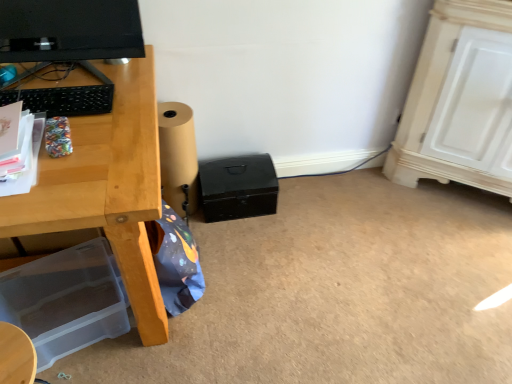
Question: Is black matte box at center, the 1th box positioned from the top, positioned before matte black monitor at upper left?

Choices:
 (A) yes
 (B) no

Answer: (B)

Question: Does black matte box at center, the first box from the right, appear on the right side of matte black monitor at upper left?

Choices:
 (A) yes
 (B) no

Answer: (A)

Question: Is matte black monitor at upper left surrounded by black matte box at center, which is counted as the second box, starting from the left?

Choices:
 (A) yes
 (B) no

Answer: (B)

Question: Considering the relative sizes of black matte box at center, the 1th box positioned from the top, and matte black monitor at upper left in the image provided, is black matte box at center, the 1th box positioned from the top, smaller than matte black monitor at upper left?

Choices:
 (A) yes
 (B) no

Answer: (B)

Question: From the image's perspective, is black matte box at center, the 1th box positioned from the top, located above matte black monitor at upper left?

Choices:
 (A) no
 (B) yes

Answer: (A)

Question: Is black matte box at center, which is counted as the second box, starting from the left, looking in the opposite direction of matte black monitor at upper left?

Choices:
 (A) no
 (B) yes

Answer: (A)

Question: Is transparent plastic storage box at lower left, the second box viewed from the top, taller than black matte box at center, the 1th box positioned from the top?

Choices:
 (A) yes
 (B) no

Answer: (B)

Question: Can you confirm if transparent plastic storage box at lower left, the second box viewed from the top, is smaller than black matte box at center, which is counted as the 2th box, starting from the bottom?

Choices:
 (A) no
 (B) yes

Answer: (A)

Question: Is transparent plastic storage box at lower left, the 2th box viewed from the right, not near black matte box at center, the first box from the right?

Choices:
 (A) no
 (B) yes

Answer: (A)

Question: Is transparent plastic storage box at lower left, which ranks as the second box in back-to-front order, in contact with black matte box at center, which is counted as the second box, starting from the left?

Choices:
 (A) yes
 (B) no

Answer: (B)

Question: Is transparent plastic storage box at lower left, acting as the first box starting from the left, to the left of black matte box at center, the first box from the right, from the viewer's perspective?

Choices:
 (A) yes
 (B) no

Answer: (A)

Question: Is transparent plastic storage box at lower left, the second box viewed from the top, facing away from black matte box at center, the first box from the right?

Choices:
 (A) no
 (B) yes

Answer: (A)

Question: Can you confirm if brown paper roll at lower center is bigger than matte black monitor at upper left?

Choices:
 (A) yes
 (B) no

Answer: (A)